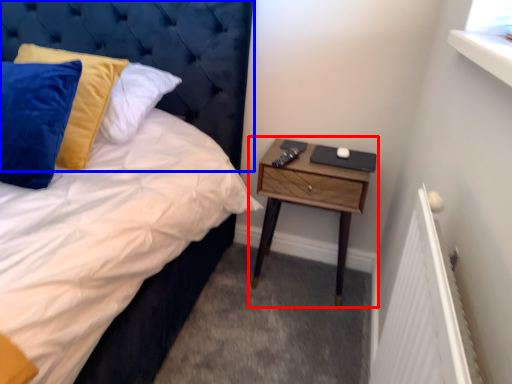
Question: Among these objects, which one is farthest to the camera, nightstand (highlighted by a red box) or headboard (highlighted by a blue box)?

Choices:
 (A) nightstand
 (B) headboard

Answer: (A)